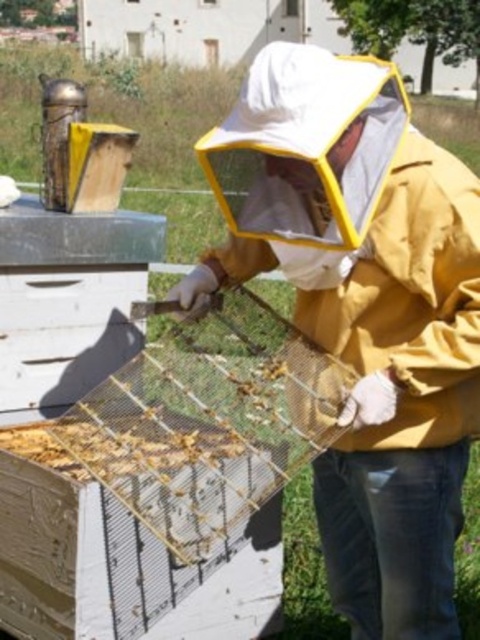
You are standing next to a beehive and want to take a photo of the yellow matte beekeeper suit at center using a camera that requires a minimum distance of 1.5 meters to focus properly. Can you take the photo without moving closer?

The yellow matte beekeeper suit at center and camera are 1.62 meters apart from each other, which is greater than the minimum required distance of 1.5 meters. Therefore, you can take the photo without moving closer.

You are a beekeeper wearing the yellow matte beekeeper suit at center. You need to place the wooden frame at center back into the hive. Which object should you move first to allow space?

The yellow matte beekeeper suit at center is in front of the wooden frame at center, so you should move the yellow matte beekeeper suit at center first to allow space.